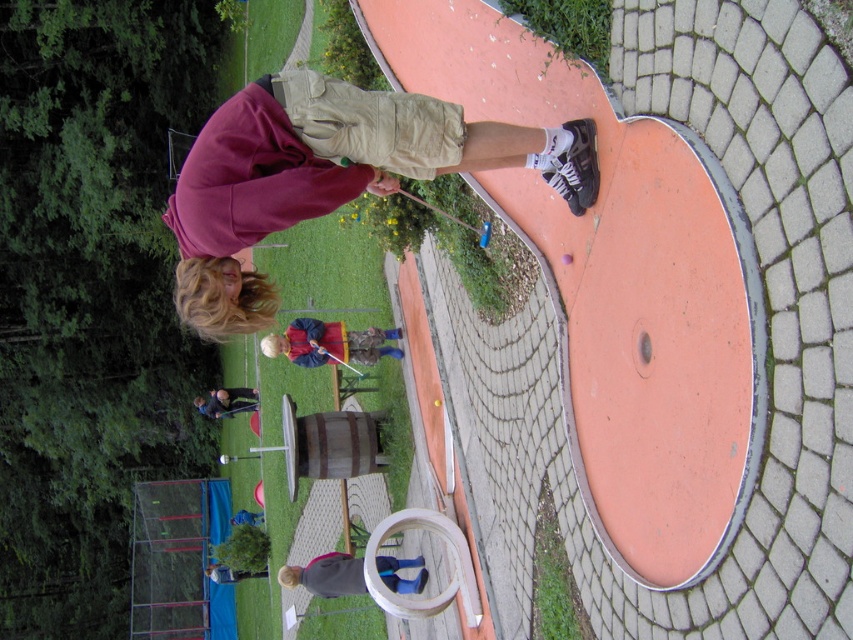
Question: Does maroon fleece jacket at upper left have a lesser width compared to matte blue shirt at center?

Choices:
 (A) no
 (B) yes

Answer: (A)

Question: Among these points, which one is nearest to the camera?

Choices:
 (A) (271, 346)
 (B) (387, 556)

Answer: (A)

Question: Is matte blue shirt at center in front of dark gray sweater at lower center?

Choices:
 (A) no
 (B) yes

Answer: (A)

Question: Which point is farther to the camera?

Choices:
 (A) (200, 256)
 (B) (281, 333)

Answer: (B)

Question: Does matte blue shirt at center appear on the right side of dark gray sweater at lower center?

Choices:
 (A) yes
 (B) no

Answer: (B)

Question: Considering the real-world distances, which object is closest to the dark gray sweater at lower center?

Choices:
 (A) maroon fleece jacket at upper left
 (B) matte blue shirt at center

Answer: (B)